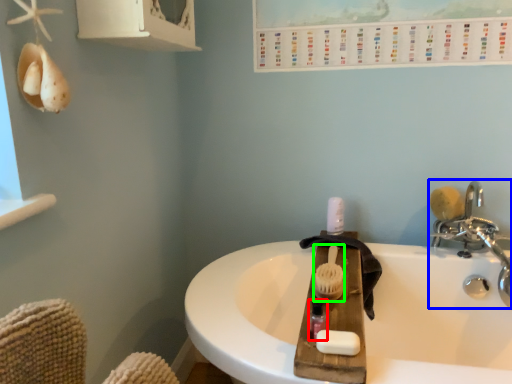
Question: Which is nearer to the mouthwash (highlighted by a red box)? tap (highlighted by a blue box) or brush (highlighted by a green box).

Choices:
 (A) tap
 (B) brush

Answer: (B)